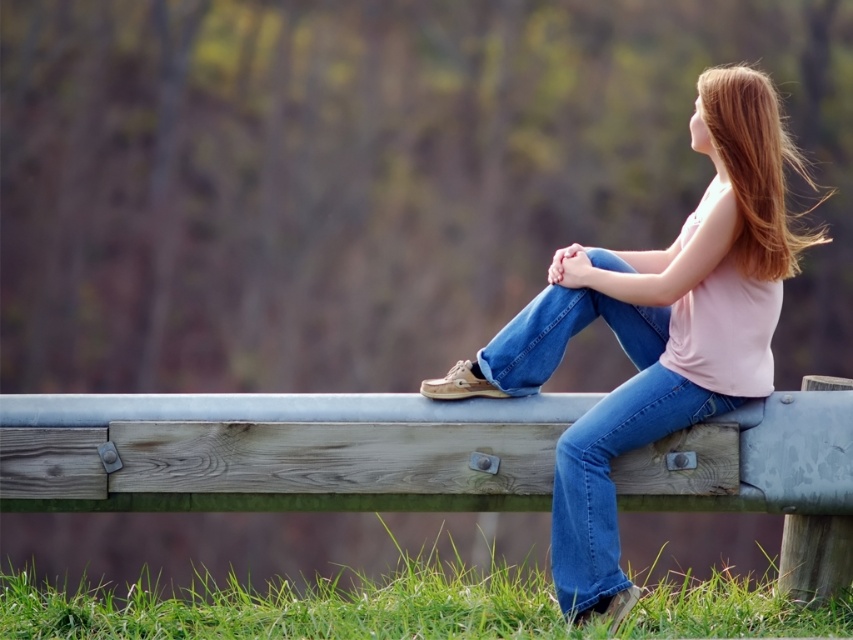
Question: Which point is farther from the camera taking this photo?

Choices:
 (A) (550, 355)
 (B) (780, 209)
 (C) (554, 522)

Answer: (A)

Question: Is weathered wood rail at center to the left of matte pink tank top at center from the viewer's perspective?

Choices:
 (A) no
 (B) yes

Answer: (B)

Question: From the image, what is the correct spatial relationship of weathered wood rail at center in relation to denim at center?

Choices:
 (A) above
 (B) below

Answer: (B)

Question: Is weathered wood rail at center to the left of denim at center from the viewer's perspective?

Choices:
 (A) yes
 (B) no

Answer: (A)

Question: Which is nearer to the weathered wood rail at center?

Choices:
 (A) matte pink tank top at center
 (B) denim at center
 (C) shiny brown hair at upper right

Answer: (B)

Question: Which object is positioned closest to the denim at center?

Choices:
 (A) weathered wood rail at center
 (B) shiny brown hair at upper right

Answer: (A)